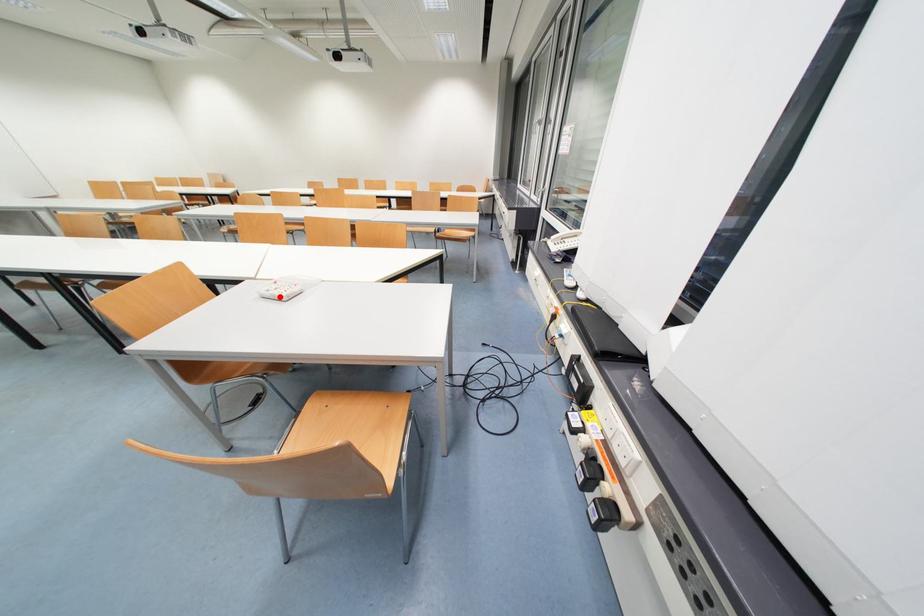
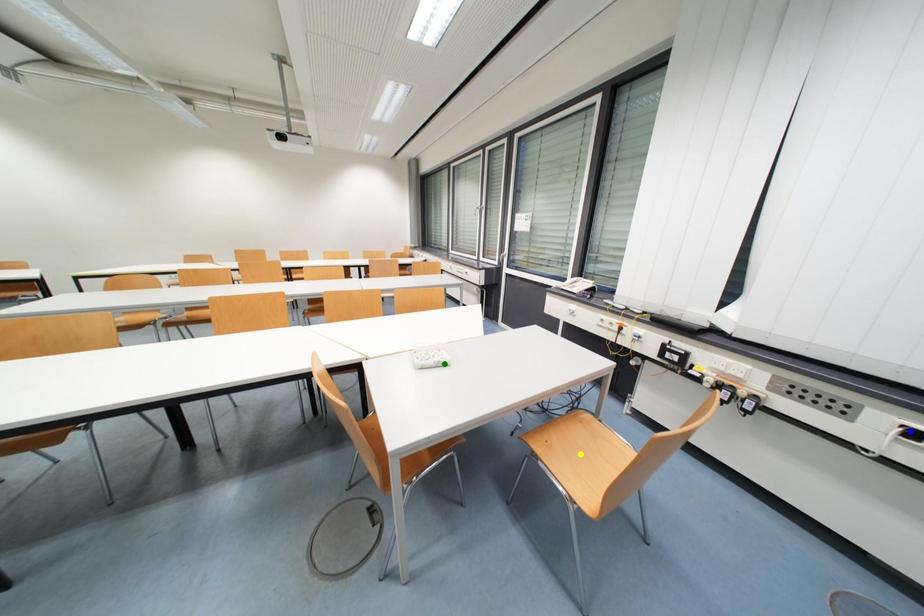
Question: I am providing you with two images of the same scene from different viewpoints. A red point is marked on the first image. You are given multiple points on the second image. Which mark in image 2 goes with the point in image 1?

Choices:
 (A) green point
 (B) blue point
 (C) yellow point

Answer: (A)